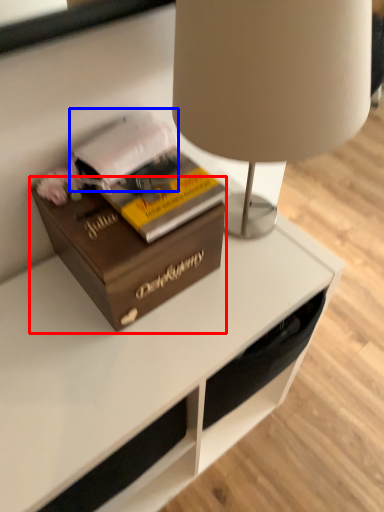
Question: Which object is further to the camera taking this photo, box (highlighted by a red box) or book (highlighted by a blue box)?

Choices:
 (A) box
 (B) book

Answer: (B)